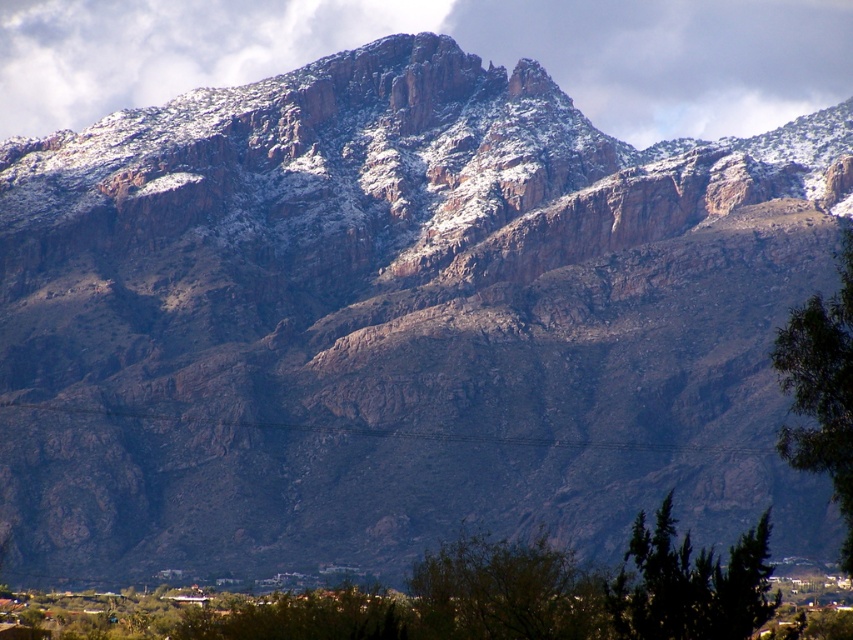
Who is more forward, (462, 531) or (643, 636)?

Point (643, 636) is in front.

This screenshot has height=640, width=853. What do you see at coordinates (503, 593) in the screenshot?
I see `green leafy tree at lower center` at bounding box center [503, 593].

Where is `green leafy tree at lower center`? This screenshot has width=853, height=640. green leafy tree at lower center is located at coordinates (503, 593).

Who is taller, dark green coniferous tree at lower right or green leafy tree at right?

Standing taller between the two is green leafy tree at right.

Is the position of dark green coniferous tree at lower right less distant than that of green leafy tree at right?

Yes, dark green coniferous tree at lower right is closer to the viewer.

Which is behind, point (743, 598) or point (824, 332)?

The point (824, 332) is behind.

Locate an element on the screen. dark green coniferous tree at lower right is located at coordinates (689, 584).

Between green leafy tree at lower center and green leafy tree at right, which one appears on the right side from the viewer's perspective?

From the viewer's perspective, green leafy tree at right appears more on the right side.

The width and height of the screenshot is (853, 640). Identify the location of green leafy tree at lower center. (503, 593).